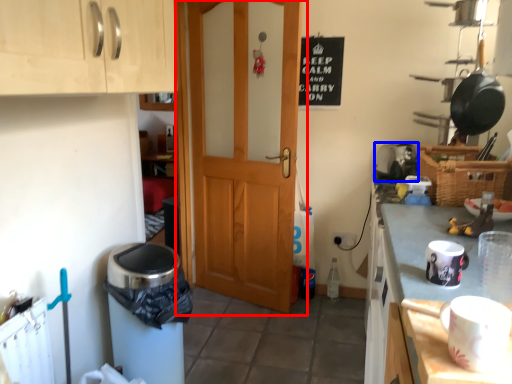
Question: Which point is closer to the camera, door (highlighted by a red box) or appliance (highlighted by a blue box)?

Choices:
 (A) door
 (B) appliance

Answer: (A)